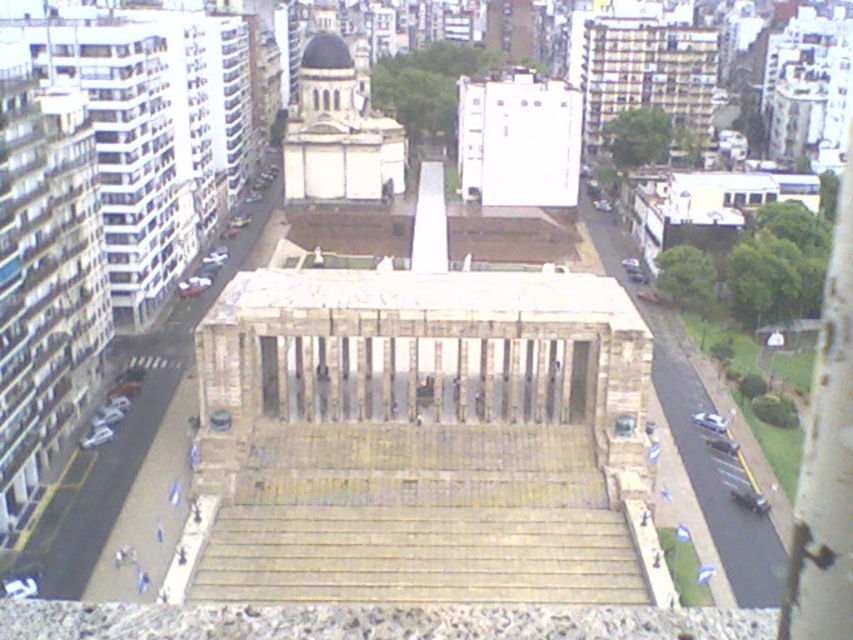
Image resolution: width=853 pixels, height=640 pixels. I want to click on smooth white pillar at right, so click(827, 460).

Image resolution: width=853 pixels, height=640 pixels. What are the coordinates of `smooth white pillar at right` in the screenshot? It's located at (827, 460).